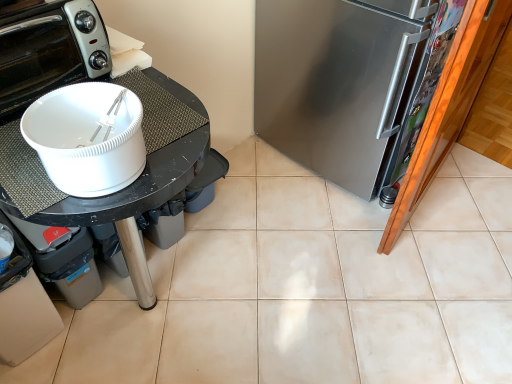
Question: From the image's perspective, is satin silver refrigerator at right located above black matte table at left?

Choices:
 (A) yes
 (B) no

Answer: (A)

Question: Can you confirm if satin silver refrigerator at right is positioned to the left of black matte table at left?

Choices:
 (A) no
 (B) yes

Answer: (A)

Question: Considering the relative sizes of satin silver refrigerator at right and black matte table at left in the image provided, is satin silver refrigerator at right wider than black matte table at left?

Choices:
 (A) yes
 (B) no

Answer: (B)

Question: Is satin silver refrigerator at right not within black matte table at left?

Choices:
 (A) yes
 (B) no

Answer: (A)

Question: Is black matte table at left located within satin silver refrigerator at right?

Choices:
 (A) no
 (B) yes

Answer: (A)

Question: Would you say white glossy toaster oven at upper left is inside or outside satin silver refrigerator at right?

Choices:
 (A) outside
 (B) inside

Answer: (A)

Question: Is white glossy toaster oven at upper left to the left or to the right of satin silver refrigerator at right in the image?

Choices:
 (A) left
 (B) right

Answer: (A)

Question: Is point (76, 33) closer or farther from the camera than point (361, 6)?

Choices:
 (A) closer
 (B) farther

Answer: (A)

Question: Looking at the image, does white glossy toaster oven at upper left seem bigger or smaller compared to satin silver refrigerator at right?

Choices:
 (A) big
 (B) small

Answer: (B)

Question: In terms of size, does black matte table at left appear bigger or smaller than white glossy toaster oven at upper left?

Choices:
 (A) small
 (B) big

Answer: (B)

Question: In the image, is black matte table at left on the left side or the right side of white glossy toaster oven at upper left?

Choices:
 (A) right
 (B) left

Answer: (A)

Question: From the image's perspective, relative to white glossy toaster oven at upper left, is black matte table at left above or below?

Choices:
 (A) above
 (B) below

Answer: (B)

Question: Considering their positions, is black matte table at left located in front of or behind white glossy toaster oven at upper left?

Choices:
 (A) behind
 (B) front

Answer: (B)

Question: From a real-world perspective, relative to satin silver refrigerator at right, is black matte table at left vertically above or below?

Choices:
 (A) below
 (B) above

Answer: (A)

Question: In terms of height, does black matte table at left look taller or shorter compared to satin silver refrigerator at right?

Choices:
 (A) tall
 (B) short

Answer: (B)